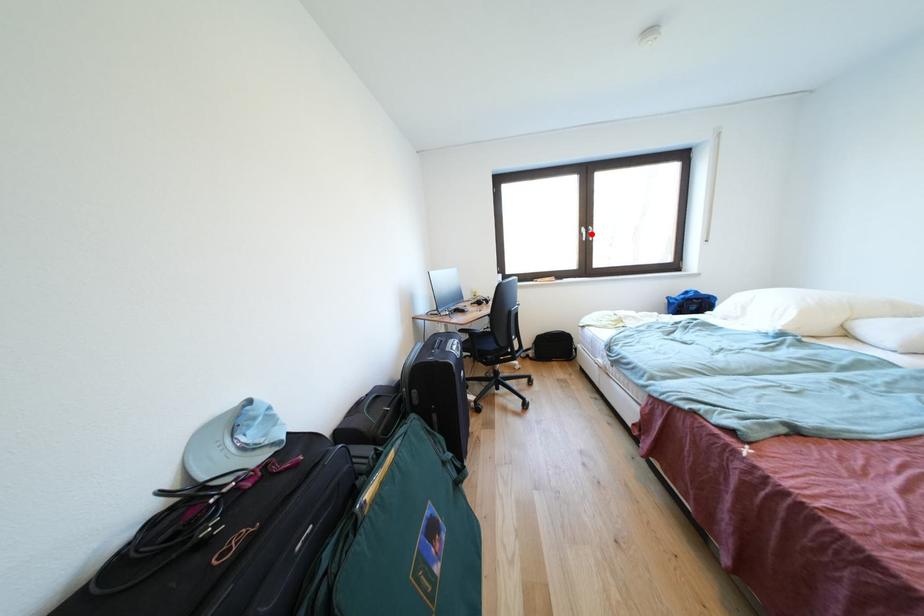
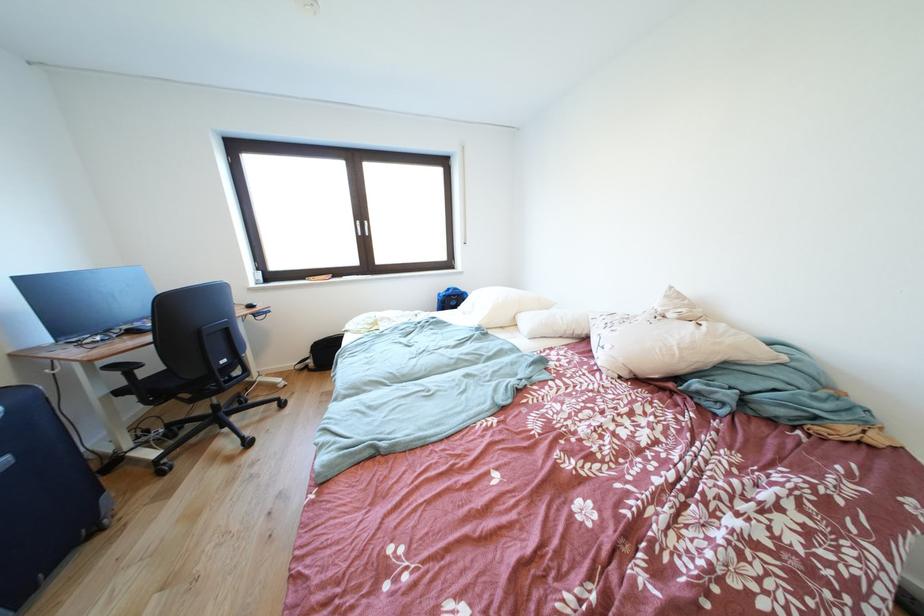
Find the pixel in the second image that matches the highlighted location in the first image.

(367, 228)